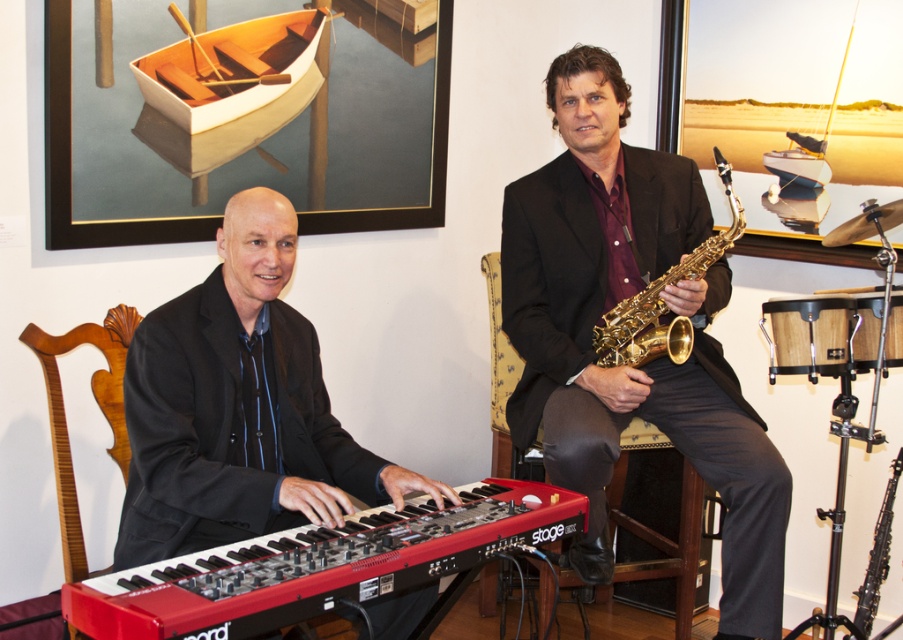
You are a stagehand measuring the space between the shiny gold saxophone at center and the edge of the stage. The stage is 3 meters wide. Can you fit a 1.5 meter wide piano between the saxophone and the stage edge?

The distance between the shiny gold saxophone at center and the viewer is 2.26 meters. Since the stage is 3 meters wide, subtracting the 2.26 meters leaves 0.74 meters remaining. This is insufficient space to fit a 1.5 meter wide piano between the saxophone and the stage edge.

Based on the photo, you are standing in the room where the two musicians are seated. You want to place a small plant exactly at the center of the room. The center is marked by the coordinates point (601,323). What object is located at that point?

The shiny gold saxophone at center is located at point (601,323).